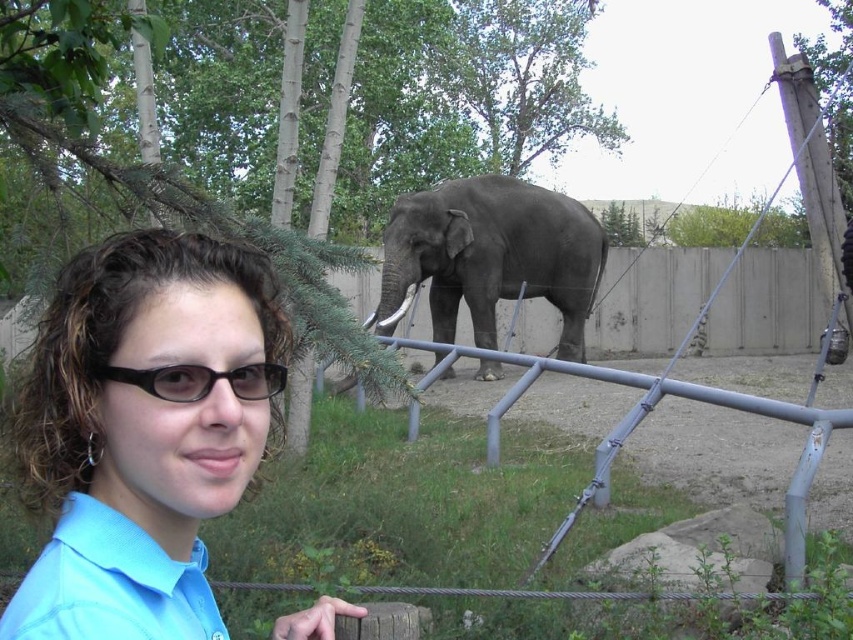
Question: Which object appears farthest from the camera in this image?

Choices:
 (A) blue shirt at center
 (B) light blue fabric shirt at lower left
 (C) black plastic glasses at center

Answer: (C)

Question: Which object appears closest to the camera in this image?

Choices:
 (A) gray matte elephant at center
 (B) blue shirt at center
 (C) light blue fabric shirt at lower left
 (D) black plastic glasses at center

Answer: (C)

Question: In this image, where is blue shirt at center located relative to black plastic glasses at center?

Choices:
 (A) below
 (B) above

Answer: (A)

Question: Is gray matte elephant at center above black plastic glasses at center?

Choices:
 (A) no
 (B) yes

Answer: (B)

Question: Observing the image, what is the correct spatial positioning of blue shirt at center in reference to light blue fabric shirt at lower left?

Choices:
 (A) left
 (B) right

Answer: (B)

Question: Which point is closer to the camera?

Choices:
 (A) gray matte elephant at center
 (B) light blue fabric shirt at lower left
 (C) blue shirt at center

Answer: (B)